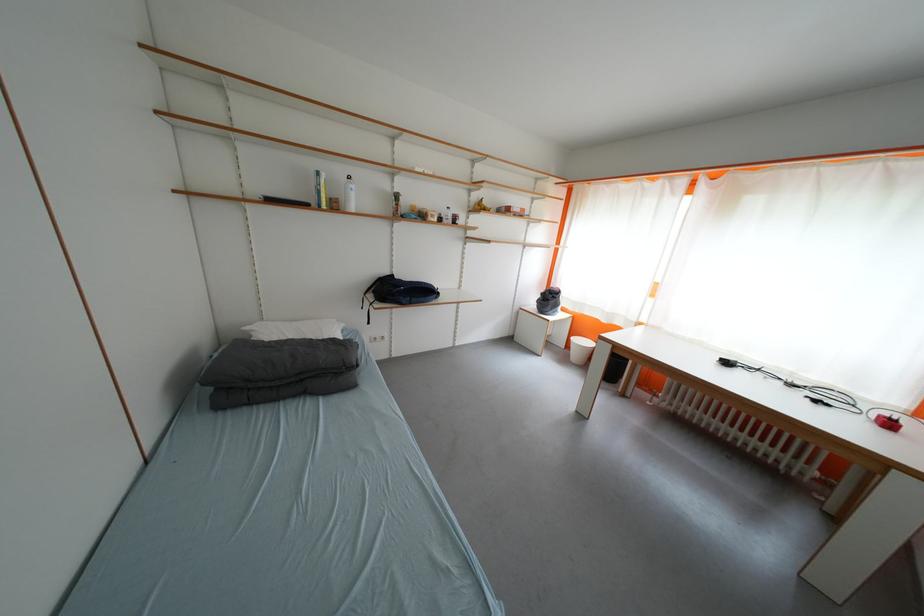
In order to click on red power adapter in this screenshot , I will do [891, 419].